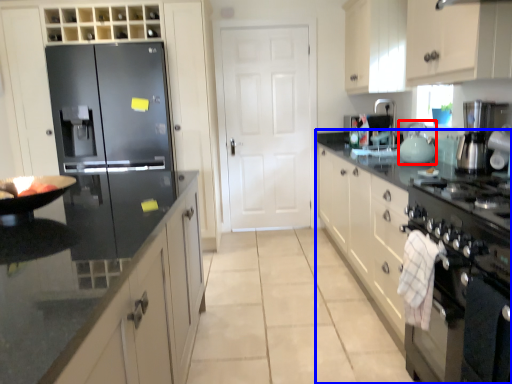
Question: Among these objects, which one is farthest to the camera, tea pot (highlighted by a red box) or cabinetry (highlighted by a blue box)?

Choices:
 (A) tea pot
 (B) cabinetry

Answer: (A)